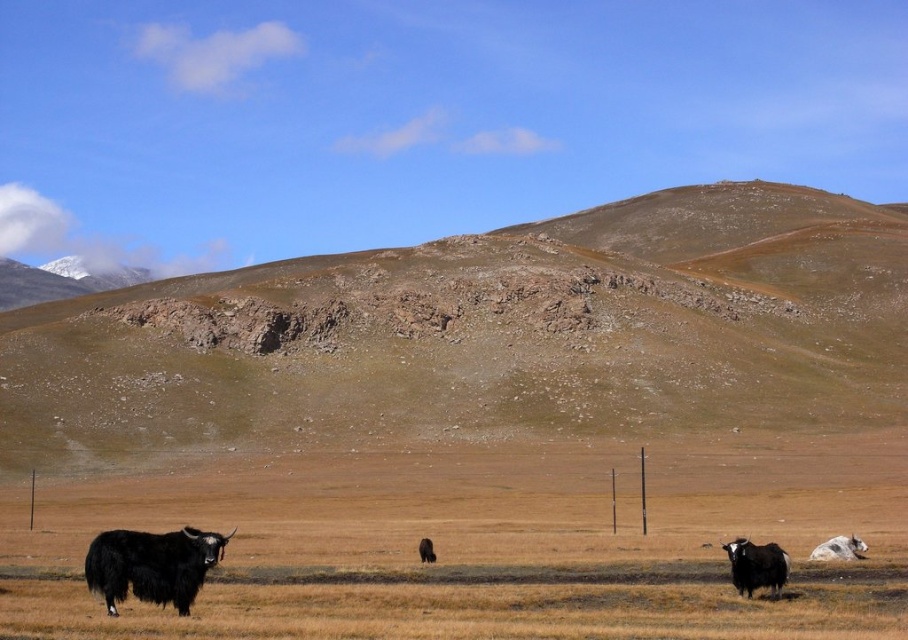
Between point (139, 534) and point (842, 547), which one is positioned behind?

Point (842, 547)

Is black fuzzy bison at lower left behind white woolen yak at lower right?

That is False.

Is point (143, 577) in front of point (831, 540)?

Yes.

This screenshot has height=640, width=908. In order to click on black fuzzy bison at lower left in this screenshot , I will do `click(151, 564)`.

Locate an element on the screen. This screenshot has height=640, width=908. brown rocky mountain at center is located at coordinates (487, 333).

The height and width of the screenshot is (640, 908). Describe the element at coordinates (487, 333) in the screenshot. I see `brown rocky mountain at center` at that location.

Which is in front, point (479, 275) or point (426, 561)?

Point (426, 561) is in front.

Find the location of a particular element. brown rocky mountain at center is located at coordinates (487, 333).

Can you confirm if white woolen yak at lower right is positioned to the right of black fuzzy yak at center?

Correct, you'll find white woolen yak at lower right to the right of black fuzzy yak at center.

Can you confirm if white woolen yak at lower right is positioned to the left of black fuzzy yak at center?

No, white woolen yak at lower right is not to the left of black fuzzy yak at center.

You are a GUI agent. You are given a task and a screenshot of the screen. Output one action in this format:
    pyautogui.click(x=<x>, y=<y>)
    Task: Click on the white woolen yak at lower right
    This screenshot has width=908, height=640.
    Given the screenshot: What is the action you would take?
    coord(839,548)